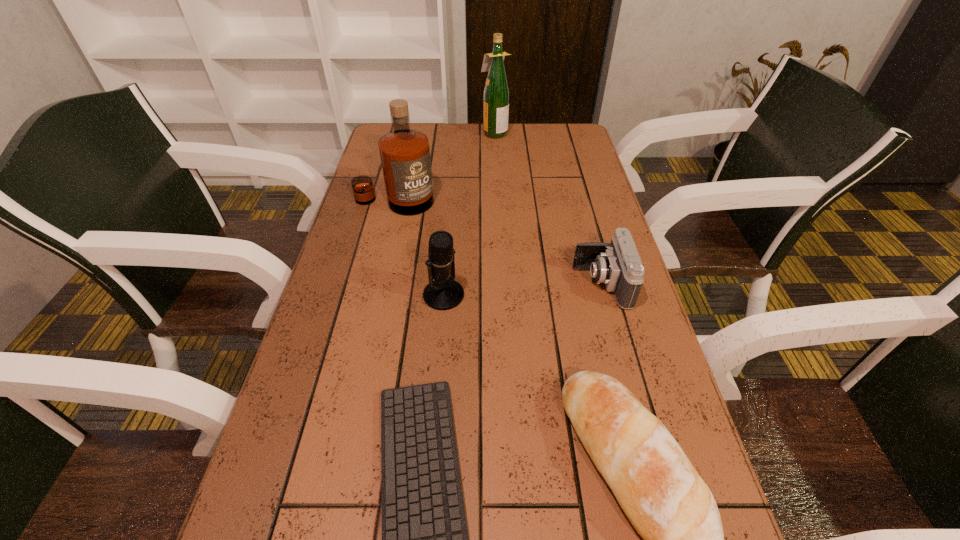
I want to click on free spot located on the back of the microphone, so click(452, 193).

At what (x,y) coordinates should I click in order to perform the action: click on free space located at the front of the camera with an open lens cover. Please return your answer as a coordinate pair (x, y). This screenshot has width=960, height=540. Looking at the image, I should click on (476, 284).

Identify the location of blank area located 0.270m at the front of the camera with an open lens cover. The width and height of the screenshot is (960, 540). (465, 284).

What are the coordinates of `blank area located 0.150m at the front of the camera with an open lens cover` in the screenshot? It's located at (514, 284).

In order to click on object that is at the far edge in this screenshot , I will do pyautogui.click(x=496, y=93).

This screenshot has width=960, height=540. Find the location of `object situated at the left edge`. object situated at the left edge is located at coordinates (404, 153).

Image resolution: width=960 pixels, height=540 pixels. I want to click on object situated at the right edge, so click(617, 264).

The image size is (960, 540). Identify the location of blank area at the left edge. (295, 379).

This screenshot has width=960, height=540. In order to click on free region at the right edge of the desktop in this screenshot , I will do `click(608, 291)`.

At what (x,y) coordinates should I click in order to perform the action: click on vacant area that lies between the fourth shortest object and the right liquor. Please return your answer as a coordinate pair (x, y). This screenshot has width=960, height=540. Looking at the image, I should click on (468, 214).